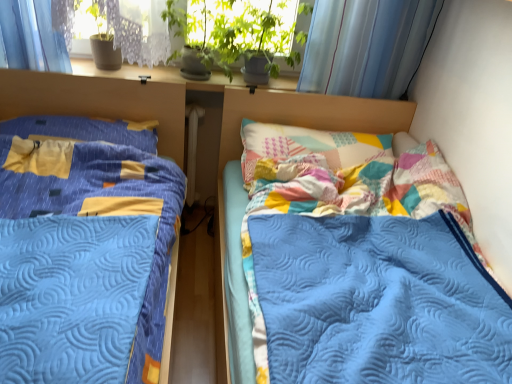
Question: Could you tell me if white plastic radiator at center is turned towards blue quilted bed at left, acting as the first bed starting from the left?

Choices:
 (A) yes
 (B) no

Answer: (B)

Question: Does white plastic radiator at center have a greater height compared to blue quilted bed at left, which is counted as the 2th bed, starting from the right?

Choices:
 (A) yes
 (B) no

Answer: (B)

Question: Is white plastic radiator at center thinner than blue quilted bed at left, which is counted as the 2th bed, starting from the right?

Choices:
 (A) yes
 (B) no

Answer: (A)

Question: Considering the relative positions of white plastic radiator at center and blue quilted bed at left, acting as the first bed starting from the left, in the image provided, is white plastic radiator at center behind blue quilted bed at left, acting as the first bed starting from the left,?

Choices:
 (A) no
 (B) yes

Answer: (B)

Question: Is white plastic radiator at center positioned with its back to blue quilted bed at left, acting as the first bed starting from the left?

Choices:
 (A) no
 (B) yes

Answer: (A)

Question: Is white plastic radiator at center not near blue quilted bed at left, which is counted as the 2th bed, starting from the right?

Choices:
 (A) no
 (B) yes

Answer: (A)

Question: Considering the relative sizes of yellow fabric pillow at left and white plastic radiator at center in the image provided, is yellow fabric pillow at left wider than white plastic radiator at center?

Choices:
 (A) yes
 (B) no

Answer: (A)

Question: Is yellow fabric pillow at left at the right side of white plastic radiator at center?

Choices:
 (A) no
 (B) yes

Answer: (A)

Question: Can you confirm if yellow fabric pillow at left is thinner than white plastic radiator at center?

Choices:
 (A) no
 (B) yes

Answer: (A)

Question: Considering the relative sizes of yellow fabric pillow at left and white plastic radiator at center in the image provided, is yellow fabric pillow at left smaller than white plastic radiator at center?

Choices:
 (A) no
 (B) yes

Answer: (A)

Question: Is yellow fabric pillow at left positioned with its back to white plastic radiator at center?

Choices:
 (A) no
 (B) yes

Answer: (A)

Question: Is yellow fabric pillow at left taller than white plastic radiator at center?

Choices:
 (A) no
 (B) yes

Answer: (A)

Question: Is quilted blue blanket at center, arranged as the second bed when viewed from the left, located outside yellow fabric pillow at left?

Choices:
 (A) yes
 (B) no

Answer: (A)